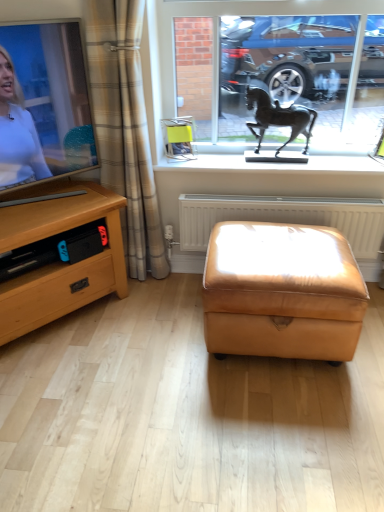
Find the location of a particular element. saddle brown leather ottoman at center is located at coordinates 282,292.

Where is `yellow fabric picture frame at center`? The height and width of the screenshot is (512, 384). yellow fabric picture frame at center is located at coordinates (178, 138).

Locate an element on the screen. The height and width of the screenshot is (512, 384). bronze horse at center is located at coordinates (278, 117).

What do you see at coordinates (270, 165) in the screenshot? This screenshot has width=384, height=512. I see `white glossy window sill at upper center` at bounding box center [270, 165].

At what (x,y) coordinates should I click in order to perform the action: click on wooden desk at left. Please return your answer as a coordinate pair (x, y). Looking at the image, I should click on (58, 262).

Does yellow fabric picture frame at center have a lesser width compared to beige plaid curtain at left?

Yes, yellow fabric picture frame at center is thinner than beige plaid curtain at left.

Is yellow fabric picture frame at center bigger or smaller than beige plaid curtain at left?

In the image, yellow fabric picture frame at center appears to be smaller than beige plaid curtain at left.

Considering the positions of objects yellow fabric picture frame at center and beige plaid curtain at left in the image provided, who is more to the right, yellow fabric picture frame at center or beige plaid curtain at left?

yellow fabric picture frame at center.

Is metallic horse statue at upper center to the left or to the right of beige plaid curtain at left in the image?

Based on their positions, metallic horse statue at upper center is located to the right of beige plaid curtain at left.

Based on the photo, between metallic horse statue at upper center and beige plaid curtain at left, which one has more height?

With more height is beige plaid curtain at left.

Locate an element on the screen. The height and width of the screenshot is (512, 384). window frame that is above the beige plaid curtain at left (from the image's perspective) is located at coordinates (278, 70).

Could you tell me if metallic horse statue at upper center is turned towards beige plaid curtain at left?

Yes, metallic horse statue at upper center is turned towards beige plaid curtain at left.

From the image's perspective, which object appears higher, beige plaid curtain at left or bronze horse at center?

bronze horse at center.

From a real-world perspective, is beige plaid curtain at left below bronze horse at center?

Yes.

Are beige plaid curtain at left and bronze horse at center located far from each other?

They are positioned close to each other.

Does beige plaid curtain at left have a lesser width compared to bronze horse at center?

Incorrect, the width of beige plaid curtain at left is not less than that of bronze horse at center.

From the image's perspective, is matte black tv at left located above or below white plastic radiator at center?

Based on their image positions, matte black tv at left is located above white plastic radiator at center.

Consider the image. Is matte black tv at left not inside white plastic radiator at center?

Yes, matte black tv at left is not within white plastic radiator at center.

Does matte black tv at left have a smaller size compared to white plastic radiator at center?

Actually, matte black tv at left might be larger than white plastic radiator at center.

From the picture: Is metallic horse statue at upper center facing towards saddle brown leather ottoman at center?

No, metallic horse statue at upper center is not oriented towards saddle brown leather ottoman at center.

The image size is (384, 512). In the image, there is a metallic horse statue at upper center. Find the location of `stool below it (from the image's perspective)`. stool below it (from the image's perspective) is located at coordinates (282, 292).

Would you say metallic horse statue at upper center is a long distance from saddle brown leather ottoman at center?

No.

Does wooden desk at left touch saddle brown leather ottoman at center?

They are not placed beside each other.

What's the angular difference between wooden desk at left and saddle brown leather ottoman at center's facing directions?

The angular difference between wooden desk at left and saddle brown leather ottoman at center is 48.5 degrees.

Consider the image. Is wooden desk at left shorter than saddle brown leather ottoman at center?

No.

Does wooden desk at left have a greater width compared to saddle brown leather ottoman at center?

Incorrect, the width of wooden desk at left does not surpass that of saddle brown leather ottoman at center.

You are a GUI agent. You are given a task and a screenshot of the screen. Output one action in this format:
    pyautogui.click(x=<x>, y=<y>)
    Task: Click on the desk located below the white glossy window sill at upper center (from the image's perspective)
    
    Given the screenshot: What is the action you would take?
    pyautogui.click(x=58, y=262)

Which is correct: white glossy window sill at upper center is inside wooden desk at left, or outside of it?

white glossy window sill at upper center is not enclosed by wooden desk at left.

Could you tell me if white glossy window sill at upper center is facing wooden desk at left?

No, white glossy window sill at upper center is not oriented towards wooden desk at left.

The height and width of the screenshot is (512, 384). Identify the location of picture frame behind the beige plaid curtain at left. (178, 138).

Locate an element on the screen. This screenshot has height=512, width=384. window frame above the beige plaid curtain at left (from a real-world perspective) is located at coordinates [278, 70].

Estimate the real-world distances between objects in this image. Which object is further from yellow fabric picture frame at center, wooden desk at left or white plastic radiator at center?

Based on the image, wooden desk at left appears to be further to yellow fabric picture frame at center.

From the image, which object appears to be nearer to metallic horse statue at upper center, matte black tv at left or wooden desk at left?

Based on the image, matte black tv at left appears to be nearer to metallic horse statue at upper center.

Based on their spatial positions, is beige plaid curtain at left or yellow fabric picture frame at center closer to saddle brown leather ottoman at center?

beige plaid curtain at left is closer to saddle brown leather ottoman at center.

Estimate the real-world distances between objects in this image. Which object is closer to metallic horse statue at upper center, saddle brown leather ottoman at center or matte black tv at left?

Based on the image, matte black tv at left appears to be nearer to metallic horse statue at upper center.

Based on their spatial positions, is yellow fabric picture frame at center or wooden desk at left further from bronze horse at center?

wooden desk at left is positioned further to the anchor bronze horse at center.

Looking at the image, which one is located closer to white glossy window sill at upper center, yellow fabric picture frame at center or beige plaid curtain at left?

yellow fabric picture frame at center lies closer to white glossy window sill at upper center than the other object.

Based on their spatial positions, is matte black tv at left or white plastic radiator at center closer to wooden desk at left?

matte black tv at left is positioned closer to the anchor wooden desk at left.

Estimate the real-world distances between objects in this image. Which object is further from saddle brown leather ottoman at center, metallic horse statue at upper center or white glossy window sill at upper center?

Among the two, metallic horse statue at upper center is located further to saddle brown leather ottoman at center.

Find the location of a particular element. This screenshot has height=512, width=384. window frame between beige plaid curtain at left and bronze horse at center from left to right is located at coordinates click(x=278, y=70).

Identify the location of television between wooden desk at left and white glossy window sill at upper center. (43, 104).

Find the location of a particular element. picture frame between metallic horse statue at upper center and saddle brown leather ottoman at center vertically is located at coordinates (178, 138).

You are a GUI agent. You are given a task and a screenshot of the screen. Output one action in this format:
    pyautogui.click(x=<x>, y=<y>)
    Task: Click on the window frame between wooden desk at left and bronze horse at center in the horizontal direction
    
    Given the screenshot: What is the action you would take?
    pyautogui.click(x=278, y=70)